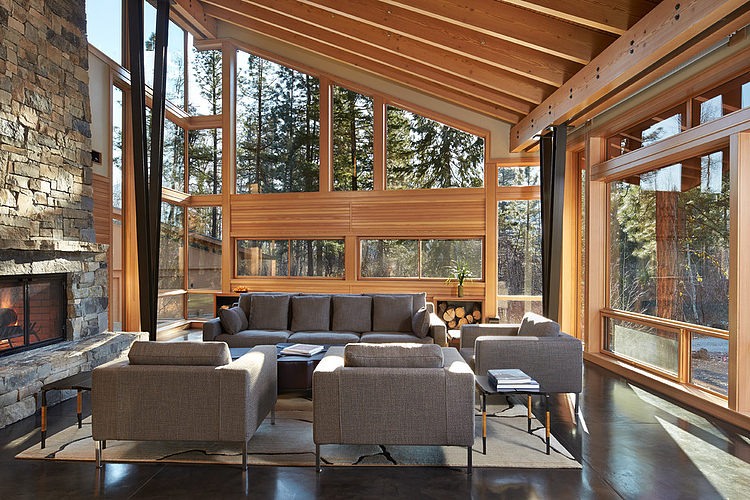
Where is `wall`? This screenshot has width=750, height=500. wall is located at coordinates (384, 234).